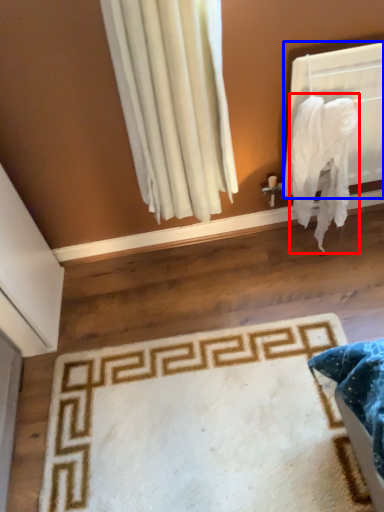
Question: Which object is further to the camera taking this photo, blanket (highlighted by a red box) or window screen (highlighted by a blue box)?

Choices:
 (A) blanket
 (B) window screen

Answer: (B)